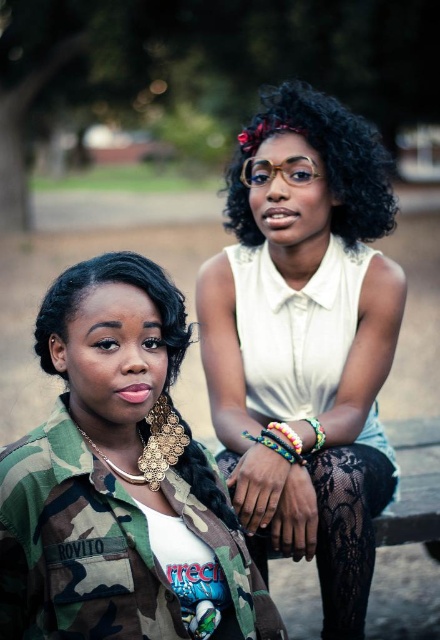
Is camo fabric jacket at left shorter than multicolored woven bracelet at center?

No.

Who is more forward, (x=190, y=436) or (x=312, y=445)?

Positioned in front is point (x=190, y=436).

Find the location of a particular element. camo fabric jacket at left is located at coordinates (120, 481).

Is point (245, 234) more distant than point (356, 605)?

Yes, point (245, 234) is behind point (356, 605).

Between curly black hair at upper center and camo fabric at lower right, which one is positioned lower?

camo fabric at lower right

The image size is (440, 640). What do you see at coordinates (322, 161) in the screenshot?
I see `curly black hair at upper center` at bounding box center [322, 161].

You are a GUI agent. You are given a task and a screenshot of the screen. Output one action in this format:
    pyautogui.click(x=<x>, y=<y>)
    Task: Click on the curly black hair at upper center
    The width and height of the screenshot is (440, 640).
    Given the screenshot: What is the action you would take?
    pyautogui.click(x=322, y=161)

Which is below, white matte blouse at center or multicolored woven bracelet at center?

multicolored woven bracelet at center is lower down.

Does white matte blouse at center have a greater width compared to multicolored woven bracelet at center?

Yes.

Where is `white matte blouse at center`? The image size is (440, 640). white matte blouse at center is located at coordinates (305, 340).

Identify the location of white matte blouse at center. Image resolution: width=440 pixels, height=640 pixels. (305, 340).